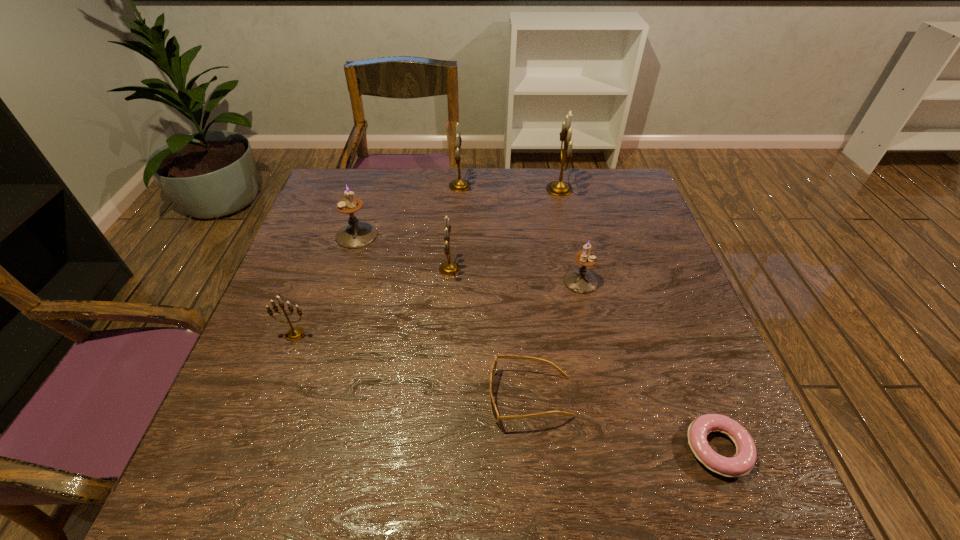
Identify the location of the biggest gold candelabrum. The image size is (960, 540). (558, 188).

The image size is (960, 540). Identify the location of the rightmost gold candelabrum. (558, 188).

This screenshot has height=540, width=960. Find the location of `the second biggest gold candelabrum`. the second biggest gold candelabrum is located at coordinates (459, 185).

Locate an element on the screen. Image resolution: width=960 pixels, height=540 pixels. the seventh shortest object is located at coordinates (459, 185).

This screenshot has height=540, width=960. I want to click on the left purple candle holder, so click(356, 234).

What are the coordinates of `the sixth nearest object` in the screenshot? It's located at (356, 234).

At what (x,y) coordinates should I click in order to perform the action: click on the second nearest gold candelabrum. Please return your answer as a coordinate pair (x, y). Looking at the image, I should click on (449, 268).

Identify the location of the nearer purple candle holder. This screenshot has width=960, height=540. (580, 280).

At what (x,y) coordinates should I click in order to perform the action: click on the smaller purple candle holder. Please return your answer as a coordinate pair (x, y). Looking at the image, I should click on (580, 280).

Where is `the nearest candelabrum`? The height and width of the screenshot is (540, 960). the nearest candelabrum is located at coordinates (294, 333).